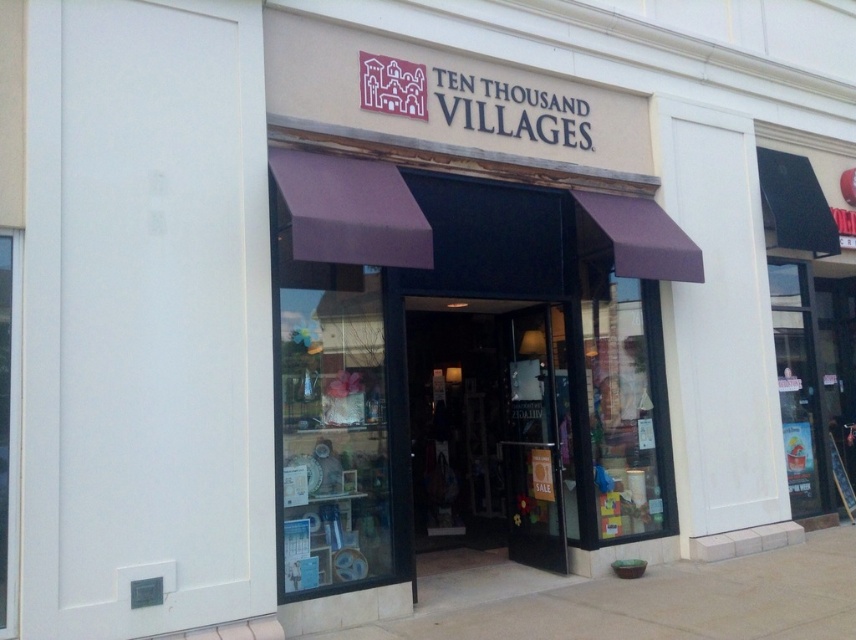
Question: Is purple fabric awning at center further to the viewer compared to transparent glass door at center?

Choices:
 (A) no
 (B) yes

Answer: (A)

Question: Which point is closer to the camera?

Choices:
 (A) transparent glass door at center
 (B) purple fabric awning at center

Answer: (B)

Question: Observing the image, what is the correct spatial positioning of purple fabric awning at center in reference to transparent glass door at center?

Choices:
 (A) left
 (B) right

Answer: (B)

Question: Is purple fabric awning at center in front of transparent glass door at center?

Choices:
 (A) no
 (B) yes

Answer: (B)